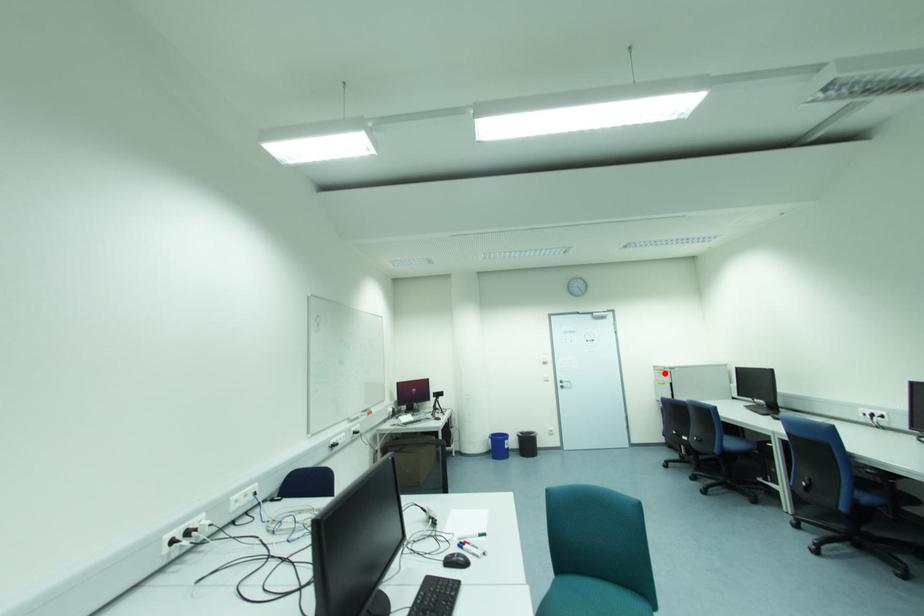
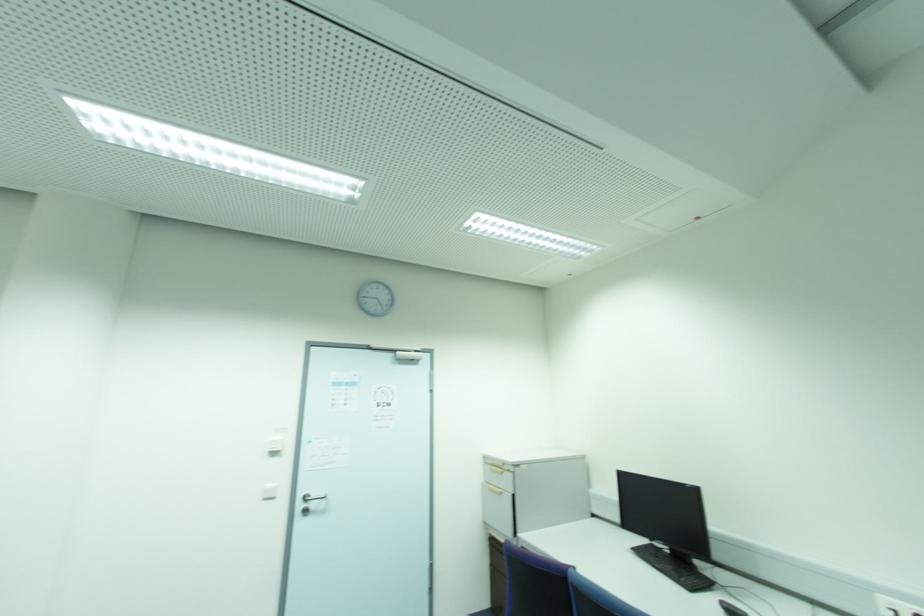
In the second image, find the point that corresponds to the highlighted location in the first image.

(503, 472)